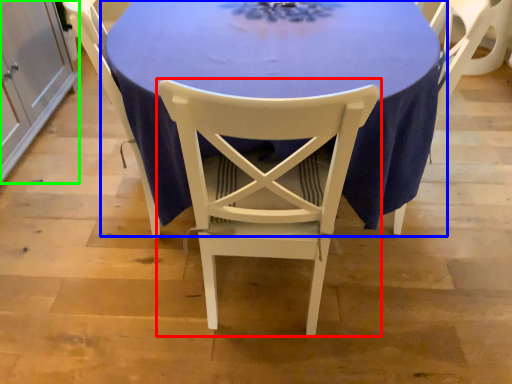
Question: Considering the real-world distances, which object is closest to chair (highlighted by a red box)? table (highlighted by a blue box) or cabinetry (highlighted by a green box).

Choices:
 (A) table
 (B) cabinetry

Answer: (A)